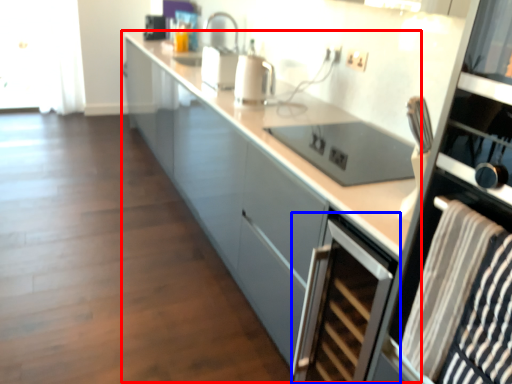
Question: Which object appears closest to the camera in this image, cabinetry (highlighted by a red box) or home appliance (highlighted by a blue box)?

Choices:
 (A) cabinetry
 (B) home appliance

Answer: (A)